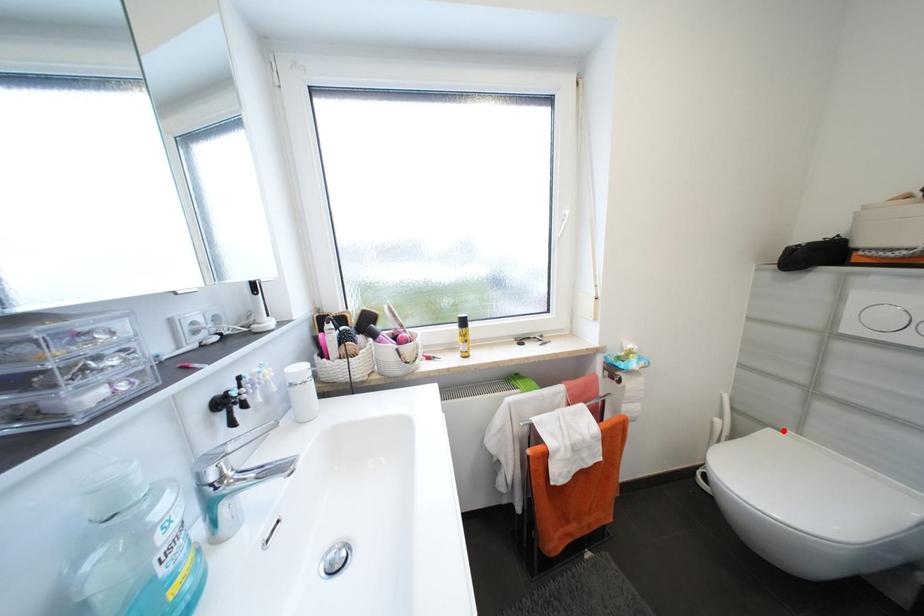
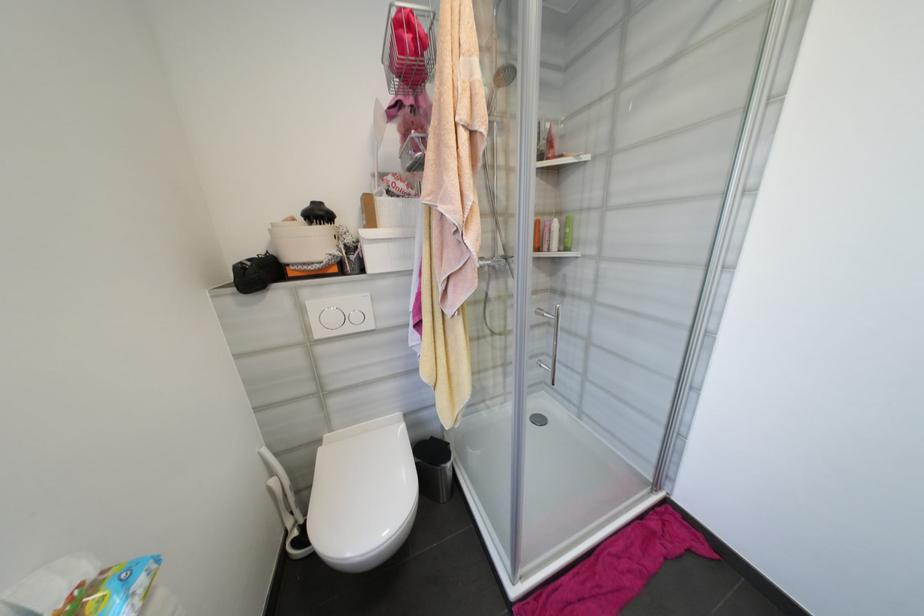
Find the pixel in the second image that matches the highlighted location in the first image.

(325, 443)